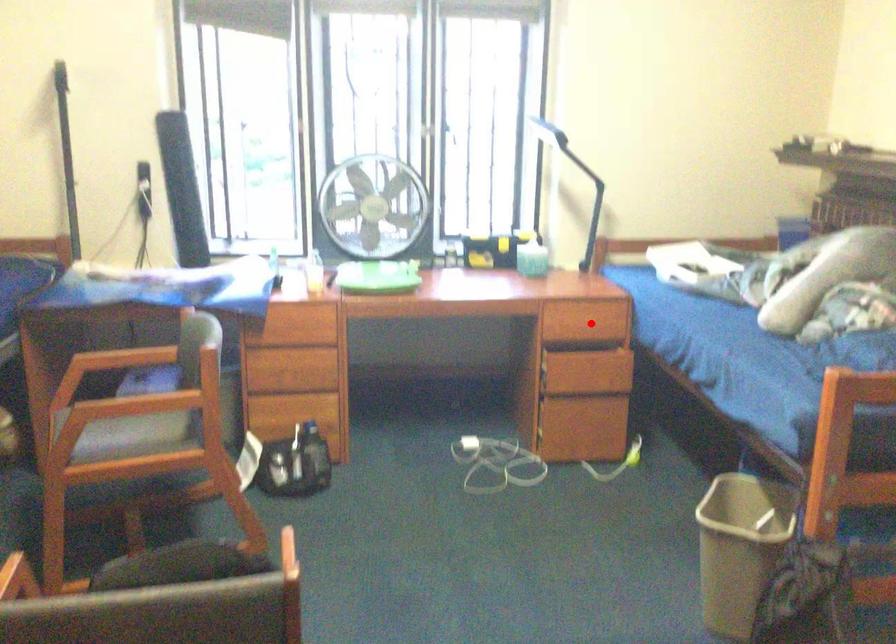
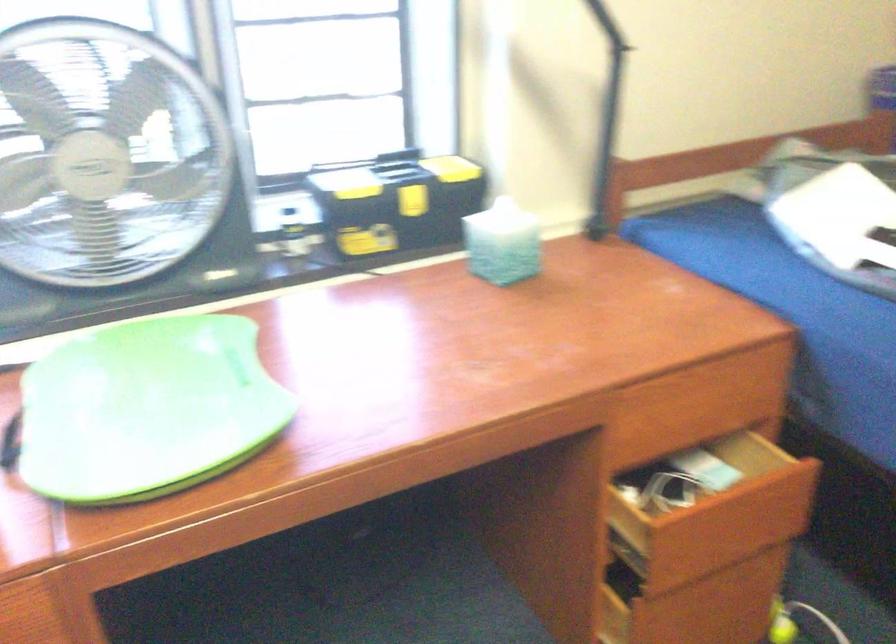
Find the pixel in the second image that matches the highlighted location in the first image.

(693, 415)